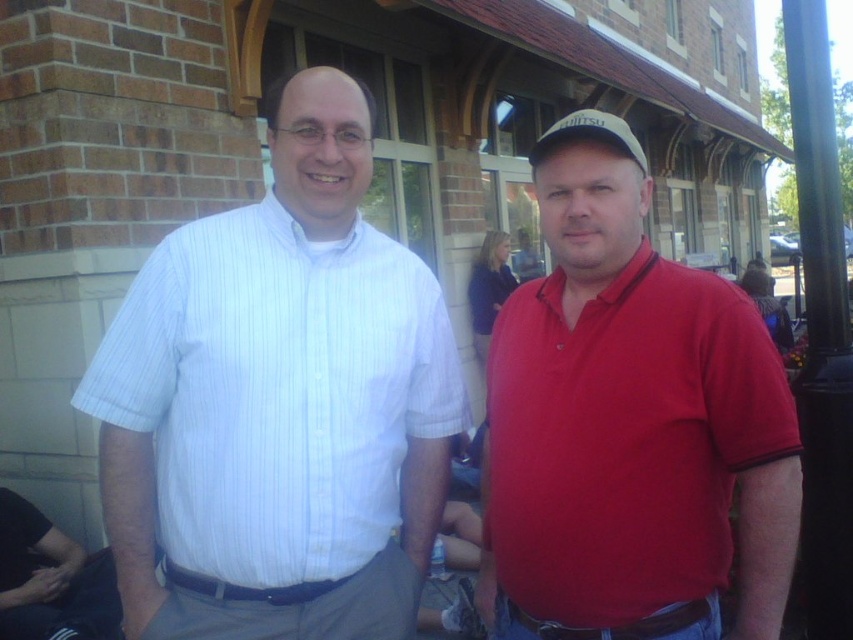
Question: Which of the following is the closest to the observer?

Choices:
 (A) (576, 212)
 (B) (256, 220)

Answer: (A)

Question: Does white striped shirt at left lie behind matte red polo shirt at center?

Choices:
 (A) yes
 (B) no

Answer: (A)

Question: Is white striped shirt at left above matte red polo shirt at center?

Choices:
 (A) no
 (B) yes

Answer: (B)

Question: Is white striped shirt at left behind matte red polo shirt at center?

Choices:
 (A) yes
 (B) no

Answer: (A)

Question: Among these objects, which one is farthest from the camera?

Choices:
 (A) white striped shirt at left
 (B) matte red polo shirt at center

Answer: (A)